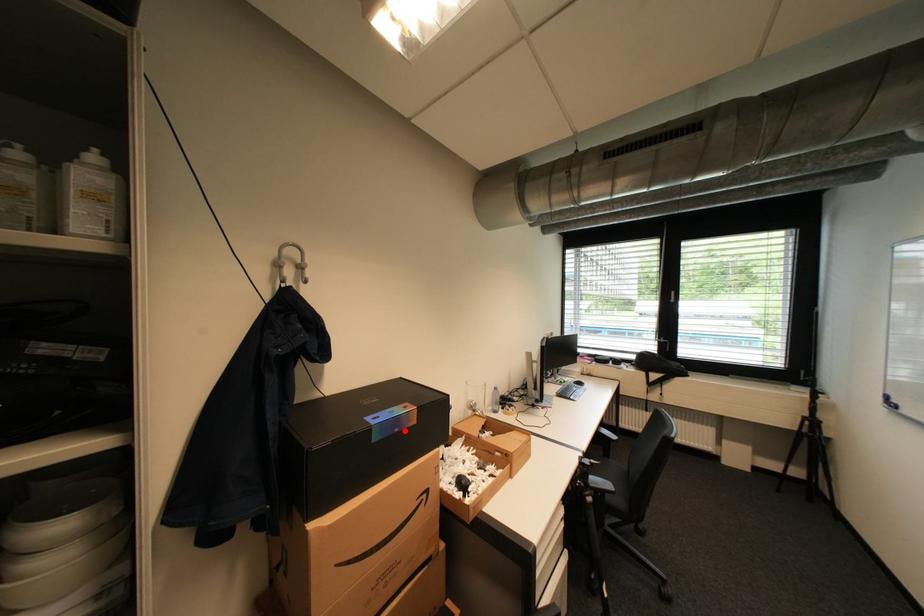
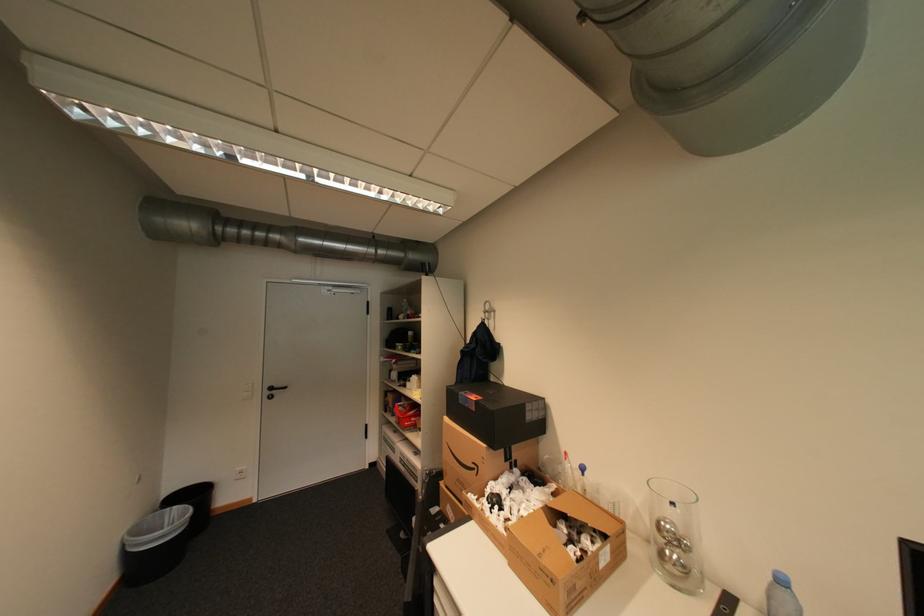
The point at the highlighted location is marked in the first image. Where is the corresponding point in the second image?

(476, 406)